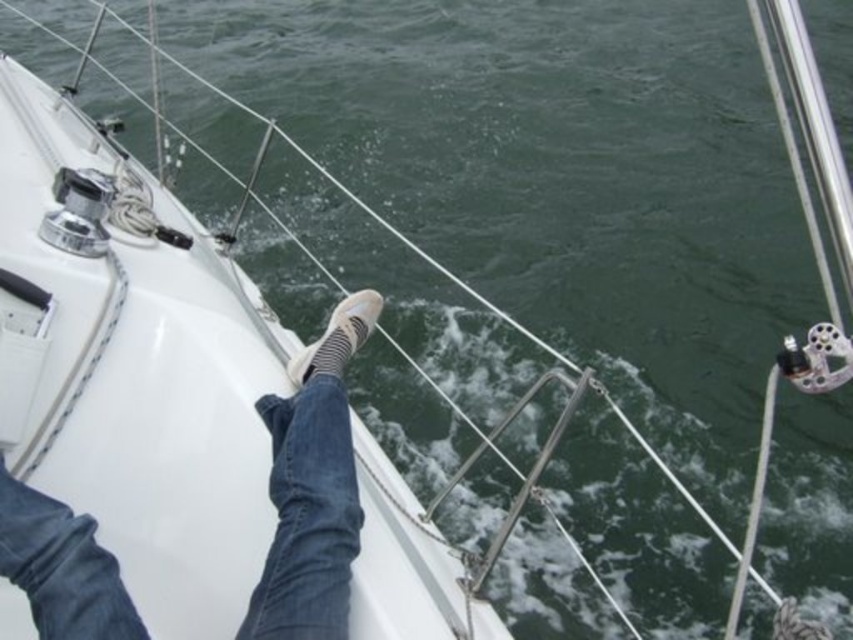
Question: Is white striped socks at center further to camera compared to white striped sock at center?

Choices:
 (A) no
 (B) yes

Answer: (A)

Question: In this image, where is white striped socks at center located relative to white striped sock at center?

Choices:
 (A) left
 (B) right

Answer: (A)

Question: Is white striped socks at center smaller than white striped sock at center?

Choices:
 (A) yes
 (B) no

Answer: (B)

Question: Among these objects, which one is farthest from the camera?

Choices:
 (A) white striped sock at center
 (B) white striped socks at center

Answer: (A)

Question: Which point is closer to the camera taking this photo?

Choices:
 (A) (344, 627)
 (B) (311, 372)

Answer: (A)